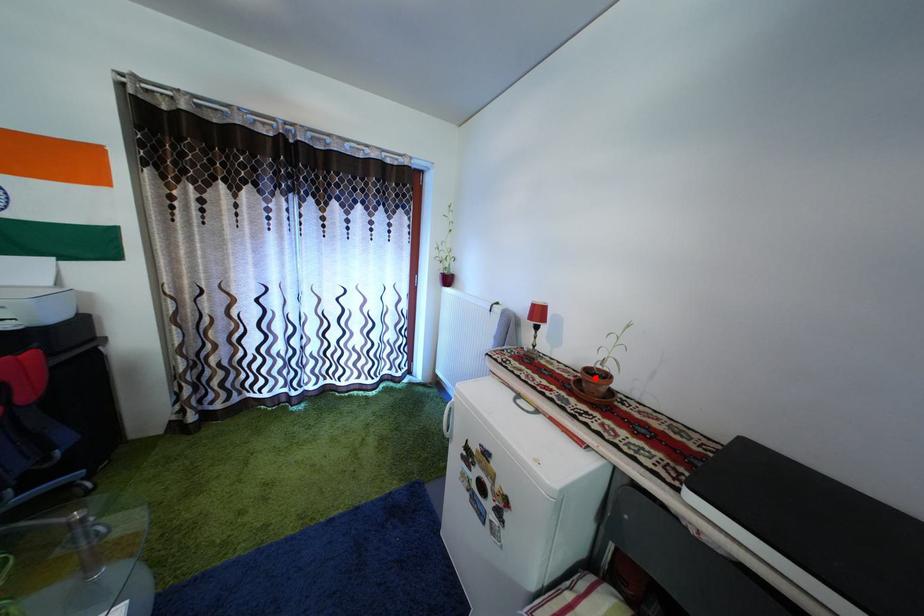
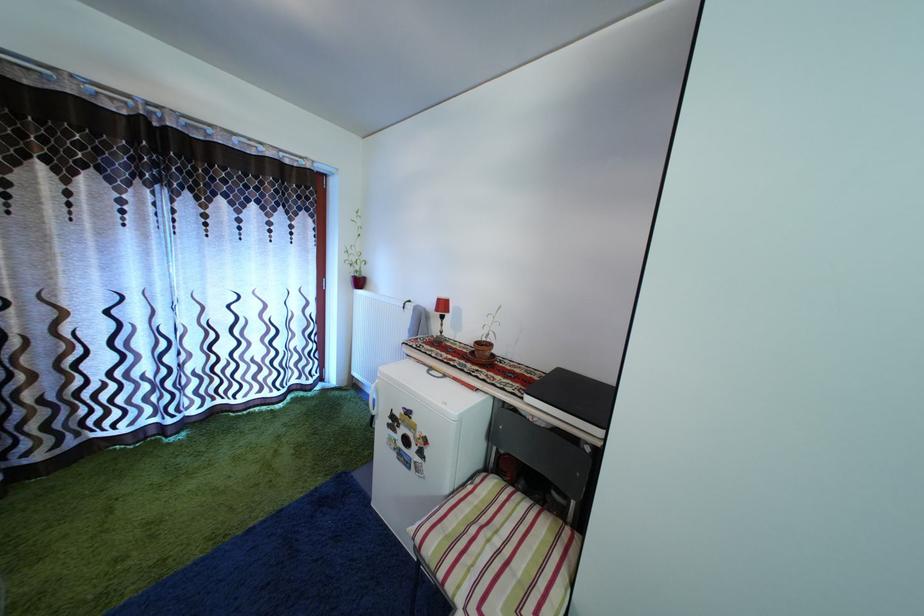
Question: I am providing you with two images of the same scene from different viewpoints. In image1, a red point is highlighted. Considering the same 3D point in image2, which of the following is correct?

Choices:
 (A) It is closer
 (B) It is farther

Answer: (B)